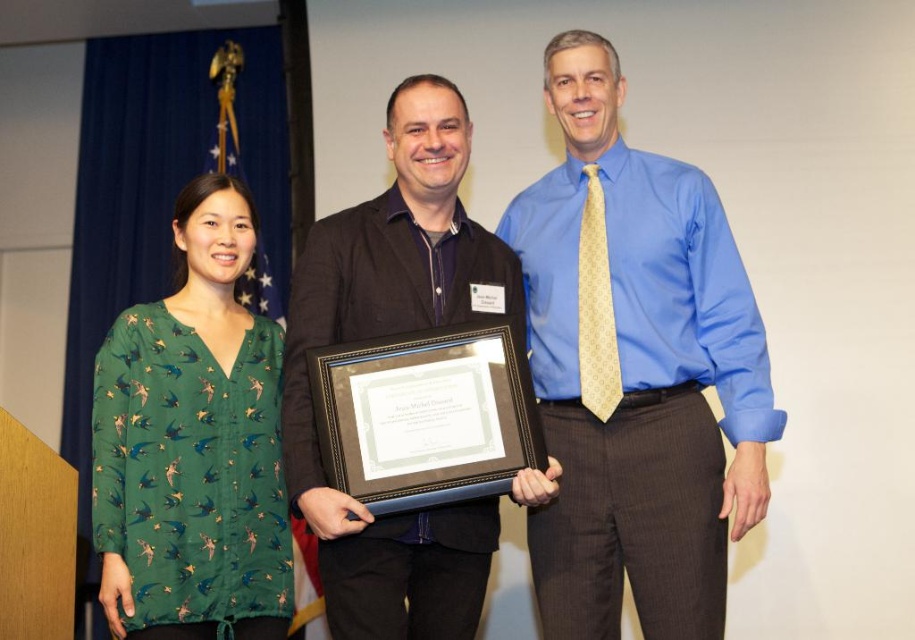
Measure the distance between blue silk shirt at center and camera.

blue silk shirt at center is 2.09 meters away from camera.

Is blue silk shirt at center wider than black matte suit at center?

Indeed, blue silk shirt at center has a greater width compared to black matte suit at center.

Does point (720, 586) come closer to viewer compared to point (396, 589)?

No, it is not.

Where is `blue silk shirt at center`? The width and height of the screenshot is (915, 640). blue silk shirt at center is located at coordinates point(634,371).

The image size is (915, 640). What do you see at coordinates (634, 371) in the screenshot?
I see `blue silk shirt at center` at bounding box center [634, 371].

From the picture: Between blue silk shirt at center and green printed blouse at left, which one appears on the right side from the viewer's perspective?

blue silk shirt at center is more to the right.

At what (x,y) coordinates should I click in order to perform the action: click on blue silk shirt at center. Please return your answer as a coordinate pair (x, y). This screenshot has height=640, width=915. Looking at the image, I should click on (634, 371).

Describe the element at coordinates (192, 444) in the screenshot. The width and height of the screenshot is (915, 640). I see `green printed blouse at left` at that location.

Is green printed blouse at left to the right of black matte suit at center from the viewer's perspective?

Incorrect, green printed blouse at left is not on the right side of black matte suit at center.

Is point (237, 576) farther from camera compared to point (433, 614)?

Yes, point (237, 576) is behind point (433, 614).

Identify the location of green printed blouse at left. This screenshot has width=915, height=640. (192, 444).